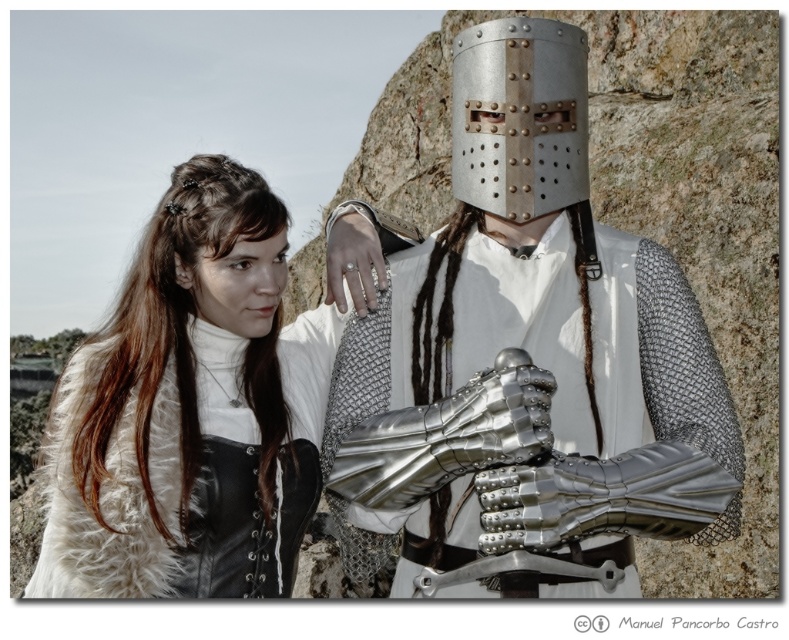
You are a knight standing at the center of a medieval battlefield. You see the metallic chainmail armor at center and the white fur vest at upper left. Your commander orders you to retrieve the fur vest first. Can you reach it before the enemy reaches the armor? The enemy is approaching the armor from the opposite direction at a speed of 5 feet per second. You can move at 10 feet per second. How much time do you have before the enemy reaches the armor?

The metallic chainmail armor at center is 30.72 feet away from the white fur vest at upper left. To determine the time, first calculate the distance between you and the fur vest. Since you are at the center, the distance to the fur vest is half of 30.72 feet, which is 15.36 feet. At your speed of 10 feet per second, it takes 1.536 seconds to reach the fur vest. The enemy is moving towards the armor at 5 feet per second. The distance between you and the armor is also 15.36 feet, so the enemy needs 3.072 to 1

You are an archer positioned at point A and need to shoot an arrow towards point B. The two points are located at coordinates point A at (357, 476) and point B at (234, 417). Based on the scene description, which point is closer to you, point A or point B?

Point A at (357, 476) is closer to the viewer than point B at (234, 417).